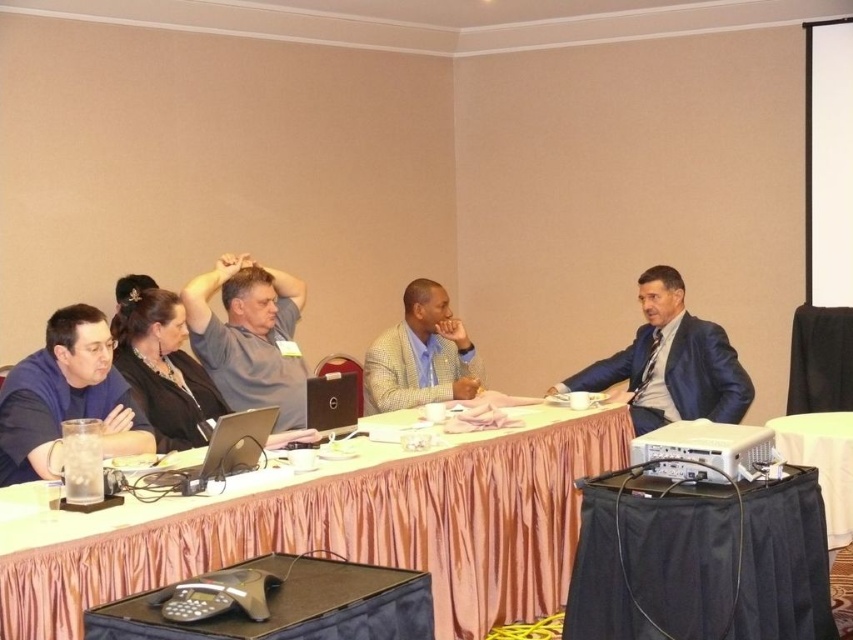
Question: Which of the following is the farthest from the observer?

Choices:
 (A) (242, 424)
 (B) (142, 353)
 (C) (276, 387)
 (D) (637, 506)

Answer: (C)

Question: Which point appears closest to the camera in this image?

Choices:
 (A) (438, 380)
 (B) (712, 410)
 (C) (791, 422)
 (D) (677, 627)

Answer: (D)

Question: Which of these objects is positioned farthest from the matte black speaker at center?

Choices:
 (A) black fabric projector at lower right
 (B) checkered fabric blazer at center
 (C) pink fabric table at center
 (D) black satin blouse at center

Answer: (A)

Question: Can you confirm if pink fabric table at center is positioned below gray matte shirt at upper center?

Choices:
 (A) yes
 (B) no

Answer: (A)

Question: Can you confirm if pink fabric table at center is smaller than black fabric table at lower right?

Choices:
 (A) yes
 (B) no

Answer: (B)

Question: Is pink fabric table at center bigger than silver metallic laptop at center?

Choices:
 (A) yes
 (B) no

Answer: (A)